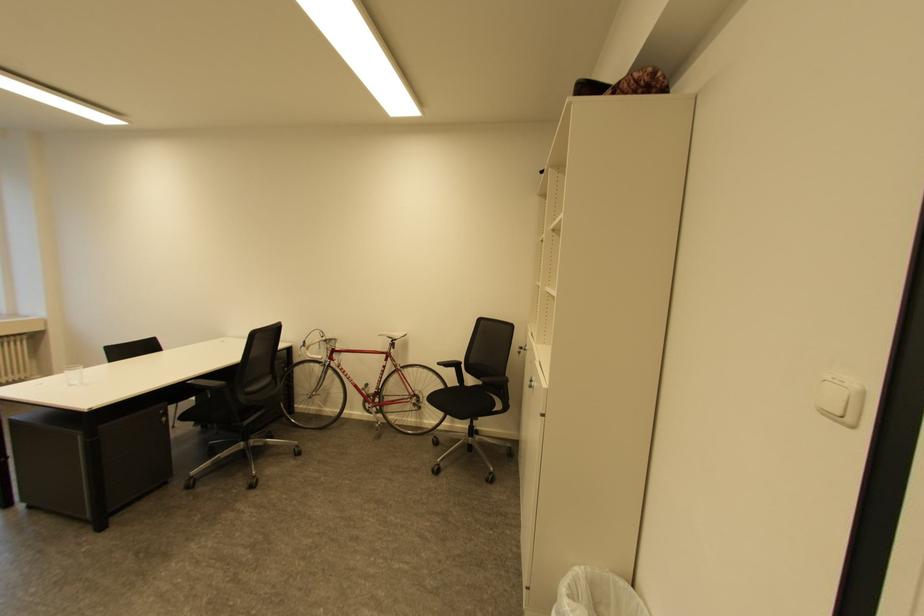
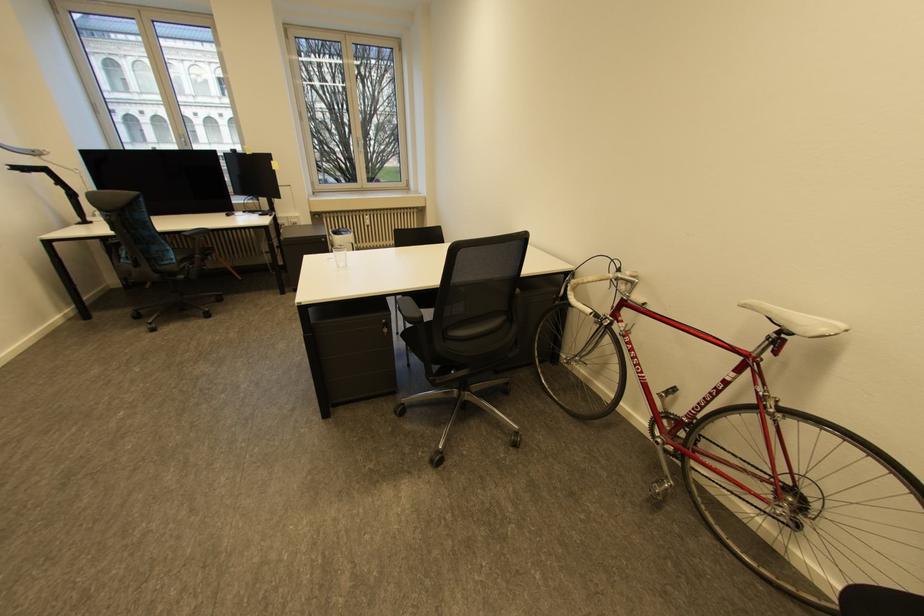
The point at (x=399, y=341) is marked in the first image. Where is the corresponding point in the second image?

(789, 331)